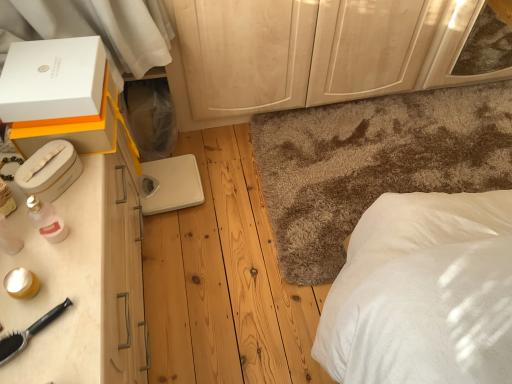
This screenshot has height=384, width=512. What are the coordinates of `vacant area that is situated to the right of white plastic box at left, which appears as the 3th box when viewed from the top` in the screenshot? It's located at click(x=86, y=183).